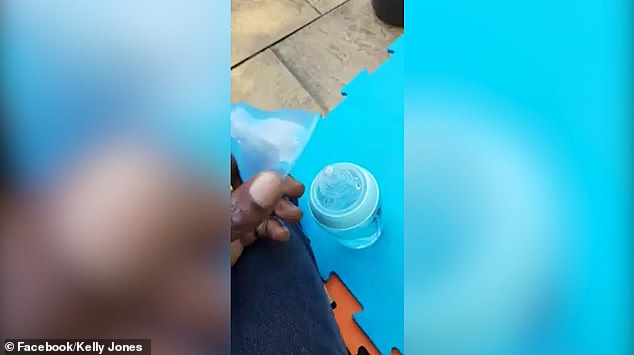
You are a GUI agent. You are given a task and a screenshot of the screen. Output one action in this format:
    pyautogui.click(x=<x>, y=<y>)
    Task: Click on the concrete tile
    The image size is (634, 355).
    Given the screenshot: What is the action you would take?
    pyautogui.click(x=332, y=50), pyautogui.click(x=264, y=78), pyautogui.click(x=255, y=23)